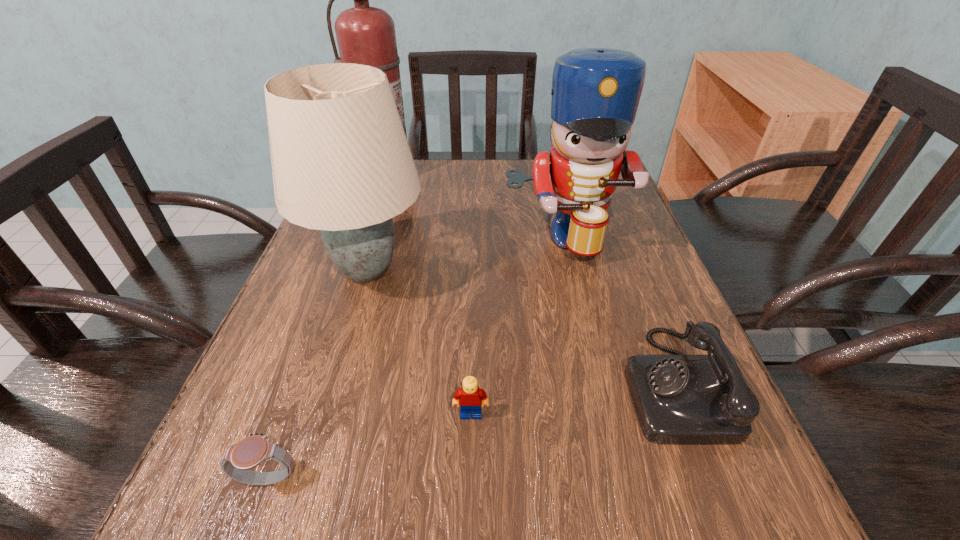
Image resolution: width=960 pixels, height=540 pixels. In order to click on nutcracker that is at the right edge in this screenshot , I will do `click(595, 92)`.

Identify the location of telephone situated at the right edge. (679, 399).

This screenshot has width=960, height=540. What are the coordinates of `object located at the far left corner` in the screenshot? It's located at (366, 35).

Where is `object that is positioned at the near left corner`? The width and height of the screenshot is (960, 540). object that is positioned at the near left corner is located at coordinates (253, 450).

In the image, there is a desktop. Where is `free space at the far edge`? free space at the far edge is located at coordinates (417, 160).

I want to click on free point at the near edge, so click(494, 488).

Where is `blank space at the left edge of the desktop`? The width and height of the screenshot is (960, 540). blank space at the left edge of the desktop is located at coordinates (x=322, y=382).

Find the location of a particular element. vacant space at the right edge of the desktop is located at coordinates (623, 217).

The image size is (960, 540). Identify the location of unoccupied area between the telephone and the tallest object. (531, 279).

Find the location of a particular element. free space between the fire extinguisher and the third object from right to left is located at coordinates pyautogui.click(x=429, y=294).